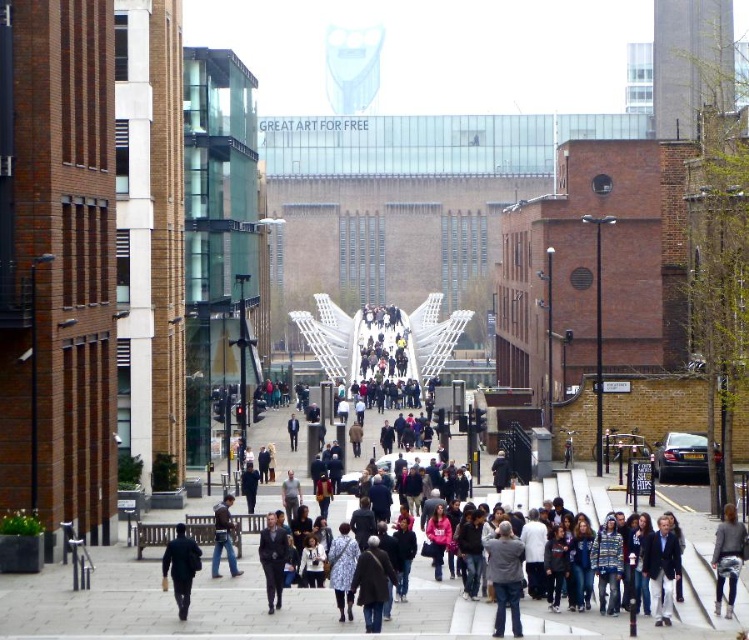
You are a photographer standing on the walkway and want to capture both the dark gray suit at center and the dark blue jeans at center in a single photo. Which one should you focus on first to ensure both are in frame?

The dark gray suit at center is below dark blue jeans at center, so you should focus on the dark blue jeans at center first to ensure both are in frame.

You are standing at the center of the walkway in the urban scene. You see a dark blue jacket at lower left. Where exactly is the dark blue jacket located in relation to your position?

The dark blue jacket at lower left is located at coordinates point (181, 566) relative to your position at the center of the walkway.

From the picture: You are a photographer standing at the end of the walkway. You want to take a photo that includes both the dark gray suit at center and the dark blue jeans at center. Which of the two should you focus on first if you want to ensure both are in frame without moving the camera?

The dark gray suit at center is not as tall as the dark blue jeans at center, so you should focus on the dark blue jeans at center first to ensure both are in frame.